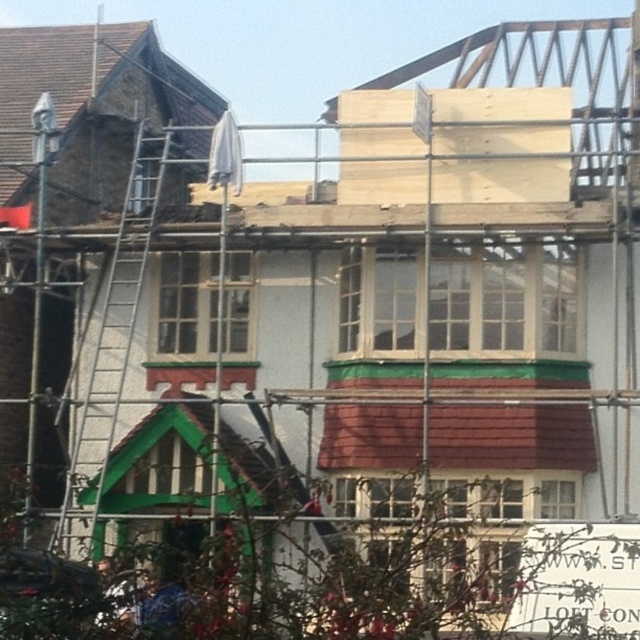
Does brown shingles at upper left appear over silver metallic ladder at left?

Correct, brown shingles at upper left is located above silver metallic ladder at left.

Does brown shingles at upper left appear under silver metallic ladder at left?

No.

The height and width of the screenshot is (640, 640). Find the location of `brown shingles at upper left`. brown shingles at upper left is located at coordinates (97, 76).

Locate an element on the screen. brown shingles at upper left is located at coordinates (97, 76).